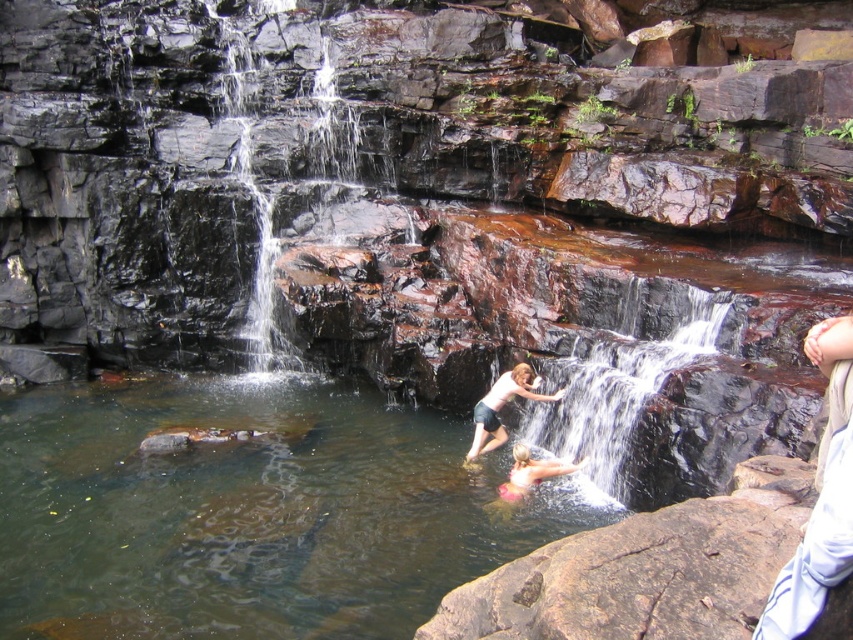
Is smooth rock waterfall at center above pink fabric at lower center?

Correct, smooth rock waterfall at center is located above pink fabric at lower center.

Between point (608, 380) and point (550, 476), which one is positioned in front?

Point (550, 476)

You are a GUI agent. You are given a task and a screenshot of the screen. Output one action in this format:
    pyautogui.click(x=<x>, y=<y>)
    Task: Click on the smooth rock waterfall at center
    This screenshot has width=853, height=640.
    Given the screenshot: What is the action you would take?
    pyautogui.click(x=616, y=390)

Locate an element on the screen. smooth rock waterfall at center is located at coordinates (616, 390).

Who is positioned more to the left, clear water at center or white cotton shirt at right?

Positioned to the left is clear water at center.

Which of these two, clear water at center or white cotton shirt at right, stands taller?

Standing taller between the two is clear water at center.

Which is in front, point (126, 484) or point (817, 611)?

Point (817, 611) is in front.

Locate an element on the screen. clear water at center is located at coordinates (245, 513).

Between white cotton shirt at right and pink fabric at lower center, which one has more height?

With more height is white cotton shirt at right.

Does white cotton shirt at right appear over pink fabric at lower center?

Indeed, white cotton shirt at right is positioned over pink fabric at lower center.

The width and height of the screenshot is (853, 640). What do you see at coordinates (820, 497) in the screenshot?
I see `white cotton shirt at right` at bounding box center [820, 497].

What are the coordinates of `white cotton shirt at right` in the screenshot? It's located at (820, 497).